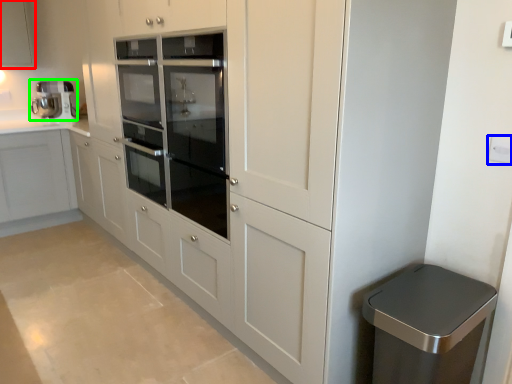
Question: Estimate the real-world distances between objects in this image. Which object is closer to cabinetry (highlighted by a red box), electric outlet (highlighted by a blue box) or home appliance (highlighted by a green box)?

Choices:
 (A) electric outlet
 (B) home appliance

Answer: (B)